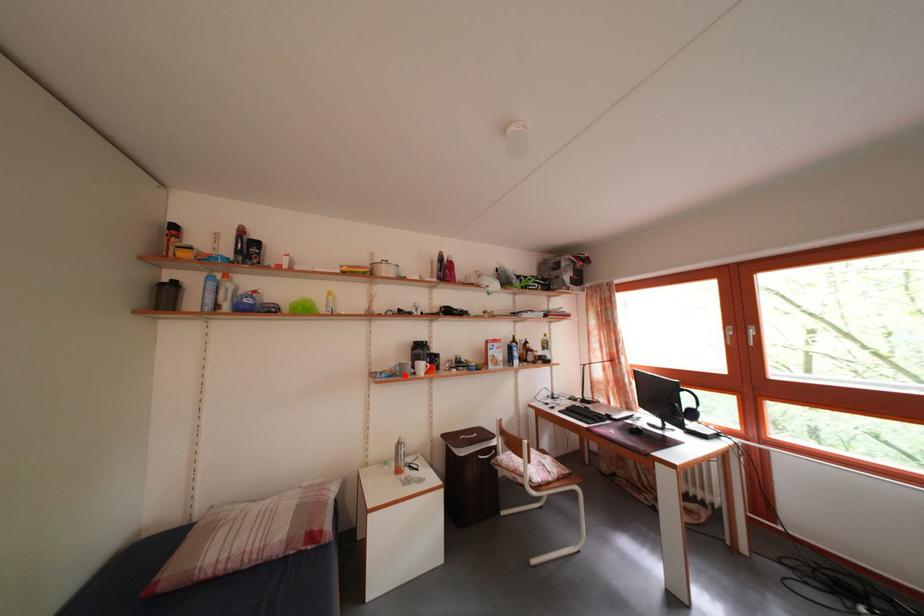
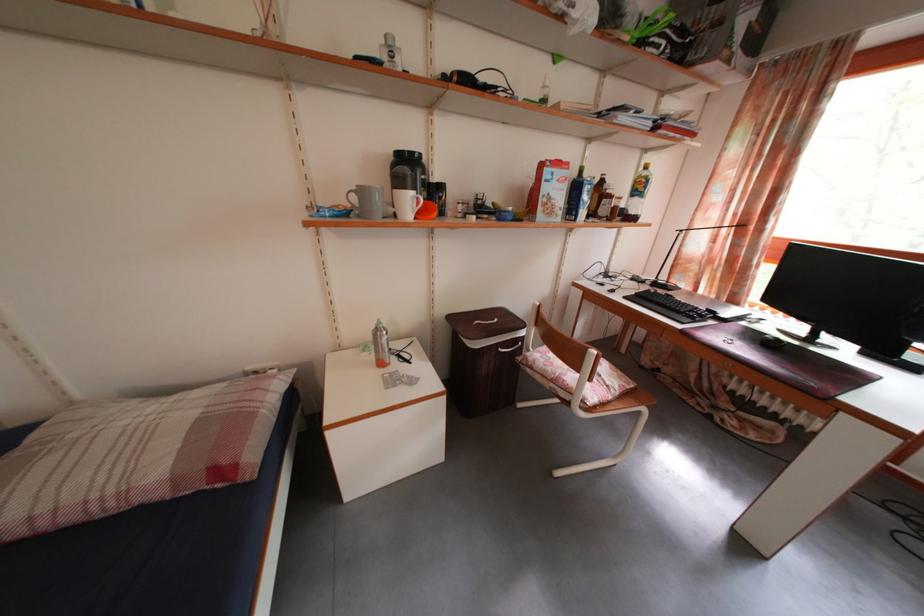
Locate, in the second image, the point that corresponds to the highlighted location in the first image.

(361, 206)